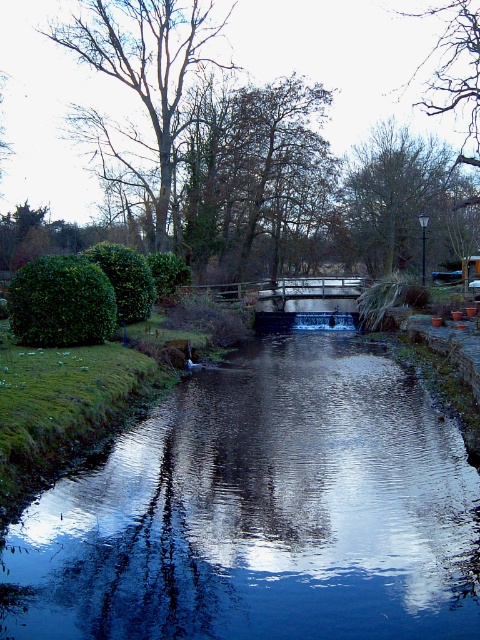
You are standing at the point marked by the coordinate point at point (x=262, y=512). Looking around, what type of surface are you currently standing on?

You are standing on smooth dark blue water at center, which is represented by the coordinate point (x=262, y=512).

You are standing on the wooden bridge and looking towards the green leafy tree at center and the smooth bark tree at upper left. Which tree is positioned higher in the image?

The smooth bark tree at upper left is positioned higher in the image than the green leafy tree at center.